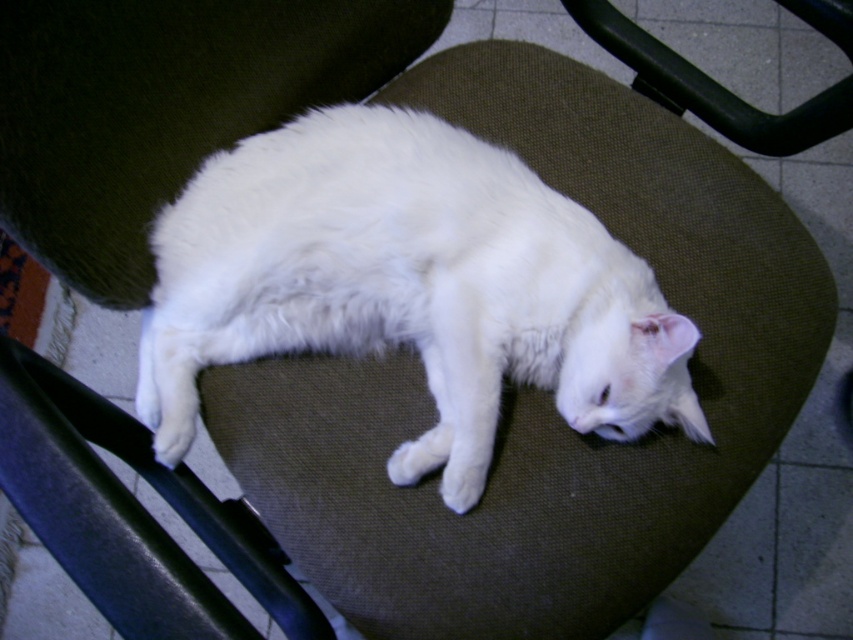
The width and height of the screenshot is (853, 640). What do you see at coordinates (408, 285) in the screenshot? I see `white fluffy cat at center` at bounding box center [408, 285].

Can you confirm if white fluffy cat at center is bigger than black plastic swivel chair at upper right?

Yes, white fluffy cat at center is bigger than black plastic swivel chair at upper right.

What do you see at coordinates (408, 285) in the screenshot?
I see `white fluffy cat at center` at bounding box center [408, 285].

You are a GUI agent. You are given a task and a screenshot of the screen. Output one action in this format:
    pyautogui.click(x=<x>, y=<y>)
    Task: Click on the white fluffy cat at center
    
    Given the screenshot: What is the action you would take?
    pyautogui.click(x=408, y=285)